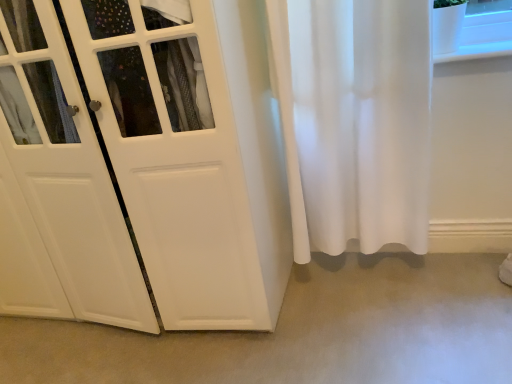
Question: Does white matte door at center have a larger size compared to beige carpet at lower center?

Choices:
 (A) yes
 (B) no

Answer: (A)

Question: Does white matte door at center come behind beige carpet at lower center?

Choices:
 (A) yes
 (B) no

Answer: (B)

Question: From a real-world perspective, is white matte door at center located beneath beige carpet at lower center?

Choices:
 (A) no
 (B) yes

Answer: (A)

Question: From a real-world perspective, is white matte door at center positioned over beige carpet at lower center based on gravity?

Choices:
 (A) no
 (B) yes

Answer: (B)

Question: Can we say white matte door at center lies outside beige carpet at lower center?

Choices:
 (A) yes
 (B) no

Answer: (A)

Question: Could you tell me if white matte door at center is turned towards beige carpet at lower center?

Choices:
 (A) no
 (B) yes

Answer: (A)

Question: From a real-world perspective, is beige carpet at lower center on top of white matte door at center?

Choices:
 (A) yes
 (B) no

Answer: (B)

Question: From the image's perspective, is beige carpet at lower center above white matte door at center?

Choices:
 (A) yes
 (B) no

Answer: (B)

Question: From a real-world perspective, does beige carpet at lower center sit lower than white matte door at center?

Choices:
 (A) yes
 (B) no

Answer: (A)

Question: Is beige carpet at lower center further to camera compared to white matte door at center?

Choices:
 (A) no
 (B) yes

Answer: (B)

Question: Is beige carpet at lower center not near white matte door at center?

Choices:
 (A) no
 (B) yes

Answer: (A)

Question: Is beige carpet at lower center oriented towards white matte door at center?

Choices:
 (A) yes
 (B) no

Answer: (B)

Question: Considering the positions of white matte door at center and beige carpet at lower center in the image, is white matte door at center bigger or smaller than beige carpet at lower center?

Choices:
 (A) small
 (B) big

Answer: (B)